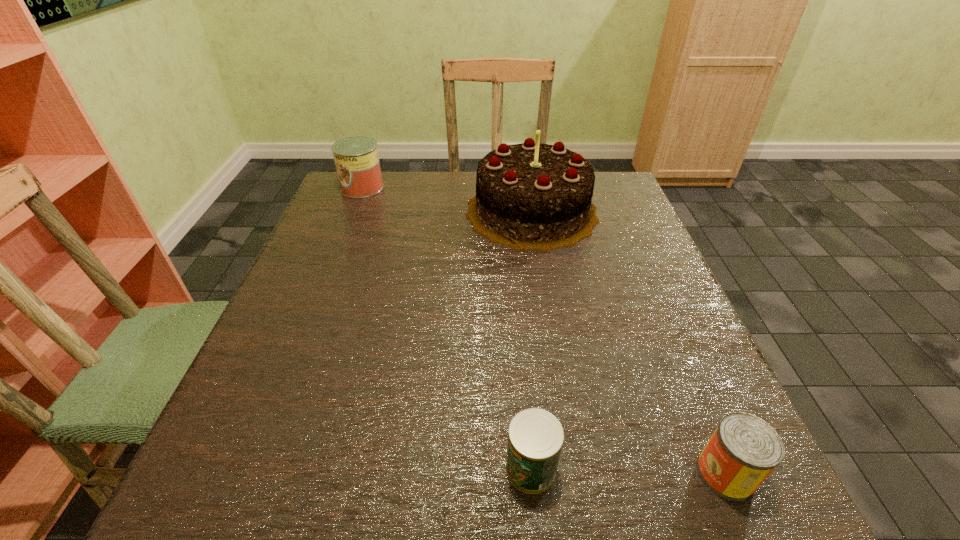
The image size is (960, 540). Find the location of `vacant space at the right edge`. vacant space at the right edge is located at coordinates (x=659, y=262).

Locate an element on the screen. The image size is (960, 540). vacant space at the far left corner of the desktop is located at coordinates (392, 187).

At what (x,y) coordinates should I click in order to perform the action: click on vacant space at the near left corner. Please return your answer as a coordinate pair (x, y). Image resolution: width=960 pixels, height=540 pixels. Looking at the image, I should click on (222, 470).

Find the location of a particular element. blank region between the tallest can and the rightmost can is located at coordinates (544, 330).

At what (x,y) coordinates should I click in order to perform the action: click on blank region between the second can from right to left and the leftmost can. Please return your answer as a coordinate pair (x, y). This screenshot has width=960, height=540. Looking at the image, I should click on (446, 328).

The width and height of the screenshot is (960, 540). I want to click on vacant region between the birthday cake and the second can from left to right, so click(531, 340).

Where is `vacant space that is in between the birthday cake and the tallest can`? The width and height of the screenshot is (960, 540). vacant space that is in between the birthday cake and the tallest can is located at coordinates (447, 200).

Locate an element on the screen. vacant space that is in between the rightmost object and the leftmost object is located at coordinates 544,330.

Locate an element on the screen. The height and width of the screenshot is (540, 960). vacant point located between the birthday cake and the rightmost can is located at coordinates (629, 342).

Where is `empty location between the rightmost object and the leftmost object`? empty location between the rightmost object and the leftmost object is located at coordinates (544, 330).